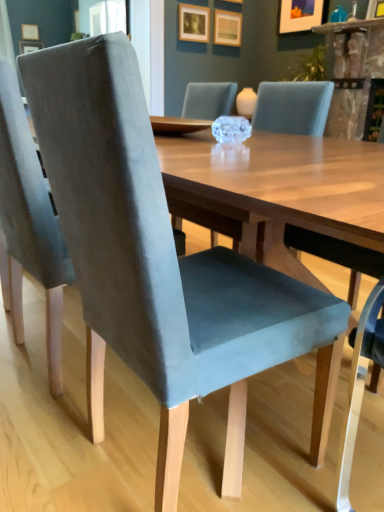
The height and width of the screenshot is (512, 384). I want to click on unoccupied area in front of velvet blue chair at left, so click(x=56, y=424).